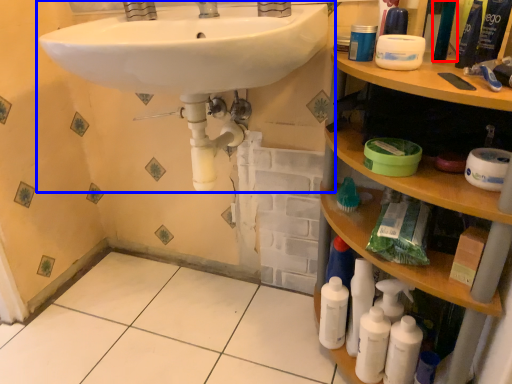
Question: Among these objects, which one is farthest to the camera, mouthwash (highlighted by a red box) or sink (highlighted by a blue box)?

Choices:
 (A) mouthwash
 (B) sink

Answer: (A)